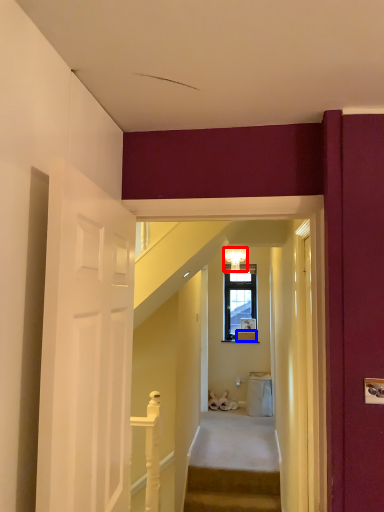
Question: Among these objects, which one is nearest to the camera, lamp (highlighted by a red box) or box (highlighted by a blue box)?

Choices:
 (A) lamp
 (B) box

Answer: (A)